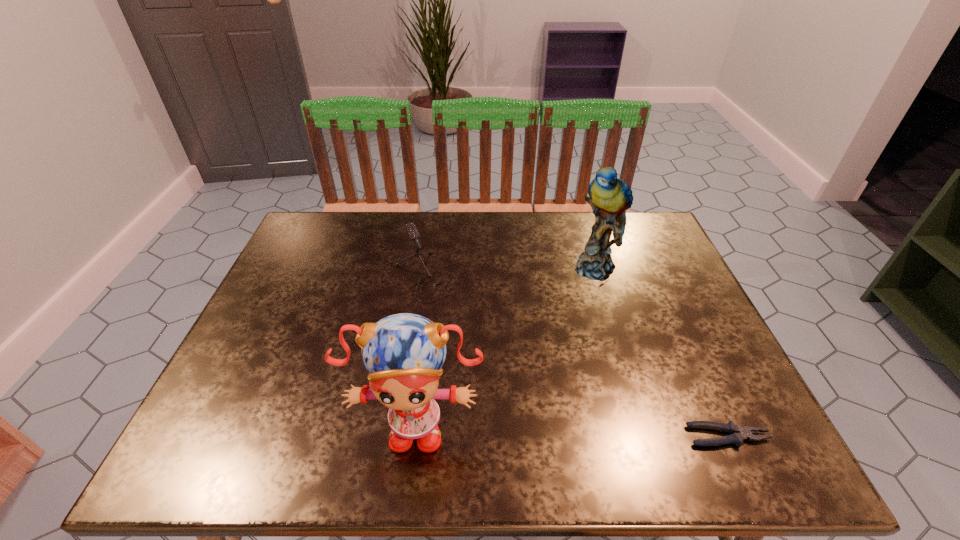
Identify the location of vacant space on the desktop that is between the third shortest object and the pliers and is positioned on the face of the tallest object. The height and width of the screenshot is (540, 960). (578, 429).

This screenshot has width=960, height=540. Find the location of `vacant space on the desktop that is between the second tallest object and the shortest object and is positioned on the stand of the second shortest object`. vacant space on the desktop that is between the second tallest object and the shortest object and is positioned on the stand of the second shortest object is located at coordinates (562, 429).